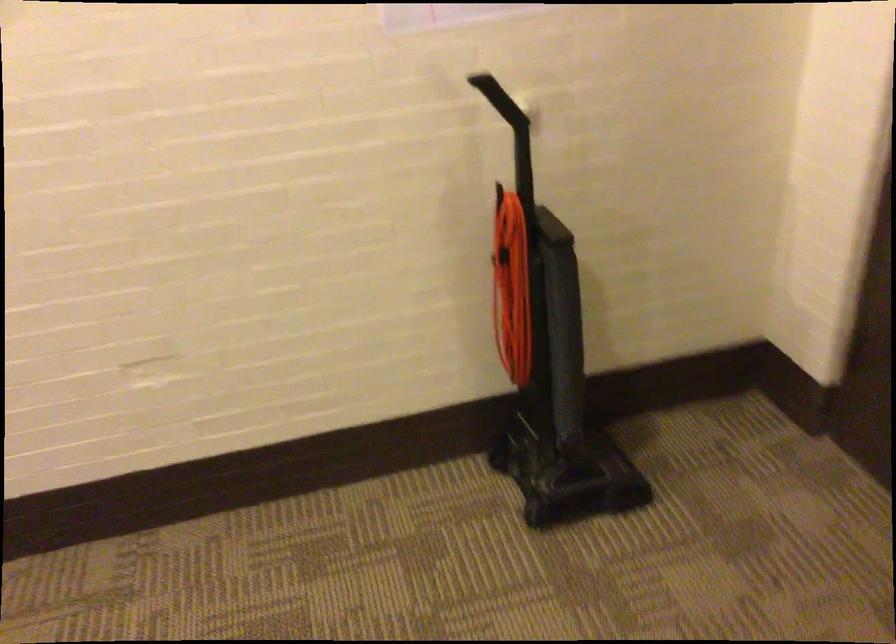
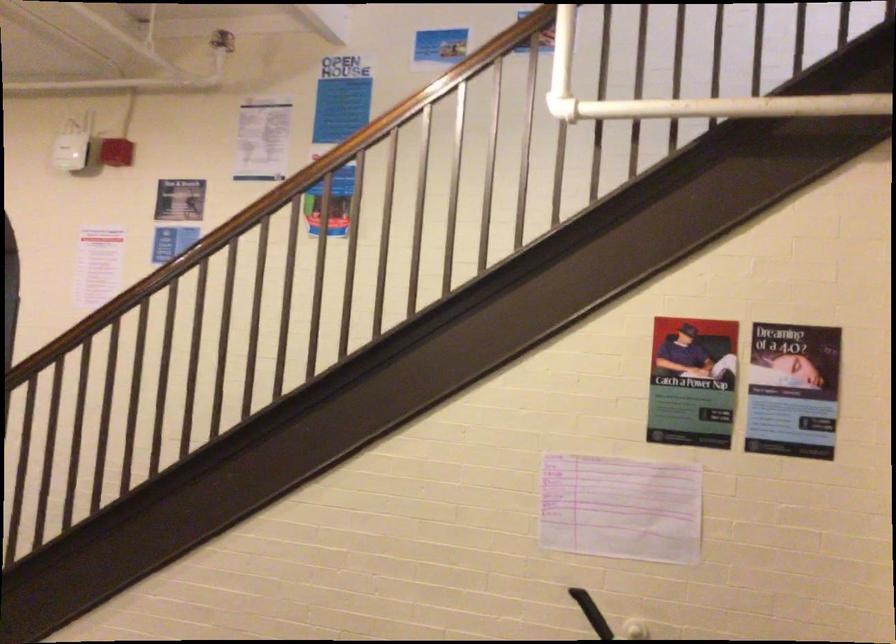
How did the camera likely rotate?

The rotation direction of the camera is left-up.